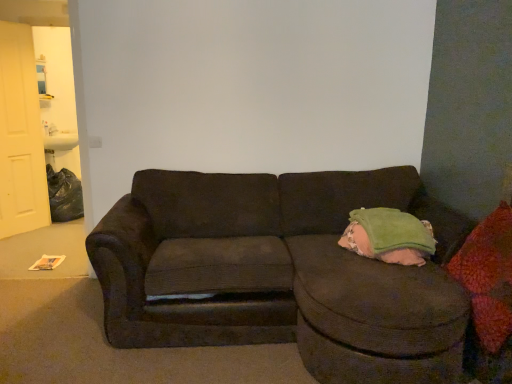
Question: Is red textured throw pillow at right far away from white matte door at left?

Choices:
 (A) yes
 (B) no

Answer: (A)

Question: Is red textured throw pillow at right at the left side of white matte door at left?

Choices:
 (A) yes
 (B) no

Answer: (B)

Question: Is red textured throw pillow at right touching white matte door at left?

Choices:
 (A) yes
 (B) no

Answer: (B)

Question: Is red textured throw pillow at right oriented towards white matte door at left?

Choices:
 (A) yes
 (B) no

Answer: (B)

Question: Is red textured throw pillow at right smaller than white matte door at left?

Choices:
 (A) yes
 (B) no

Answer: (A)

Question: Is red textured throw pillow at right completely or partially outside of white matte door at left?

Choices:
 (A) yes
 (B) no

Answer: (A)

Question: From the image's perspective, is dark corduroy couch at center over green corduroy bean bag chair at right?

Choices:
 (A) yes
 (B) no

Answer: (B)

Question: Is green corduroy bean bag chair at right surrounded by dark corduroy couch at center?

Choices:
 (A) no
 (B) yes

Answer: (B)

Question: From a real-world perspective, is dark corduroy couch at center physically above green corduroy bean bag chair at right?

Choices:
 (A) no
 (B) yes

Answer: (A)

Question: Considering the relative positions of dark corduroy couch at center and green corduroy bean bag chair at right in the image provided, is dark corduroy couch at center to the left of green corduroy bean bag chair at right from the viewer's perspective?

Choices:
 (A) yes
 (B) no

Answer: (A)

Question: Is dark corduroy couch at center wider than green corduroy bean bag chair at right?

Choices:
 (A) yes
 (B) no

Answer: (A)

Question: Could you tell me if dark corduroy couch at center is turned towards green corduroy bean bag chair at right?

Choices:
 (A) no
 (B) yes

Answer: (B)

Question: Is red textured throw pillow at right completely or partially outside of green corduroy bean bag chair at right?

Choices:
 (A) yes
 (B) no

Answer: (A)